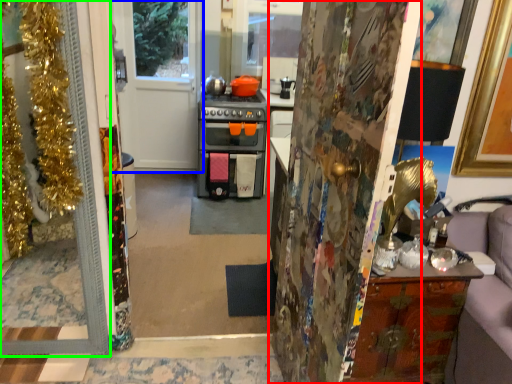
Question: Which object is the farthest from door (highlighted by a red box)? Choose among these: door (highlighted by a blue box) or door (highlighted by a green box).

Choices:
 (A) door
 (B) door

Answer: (A)